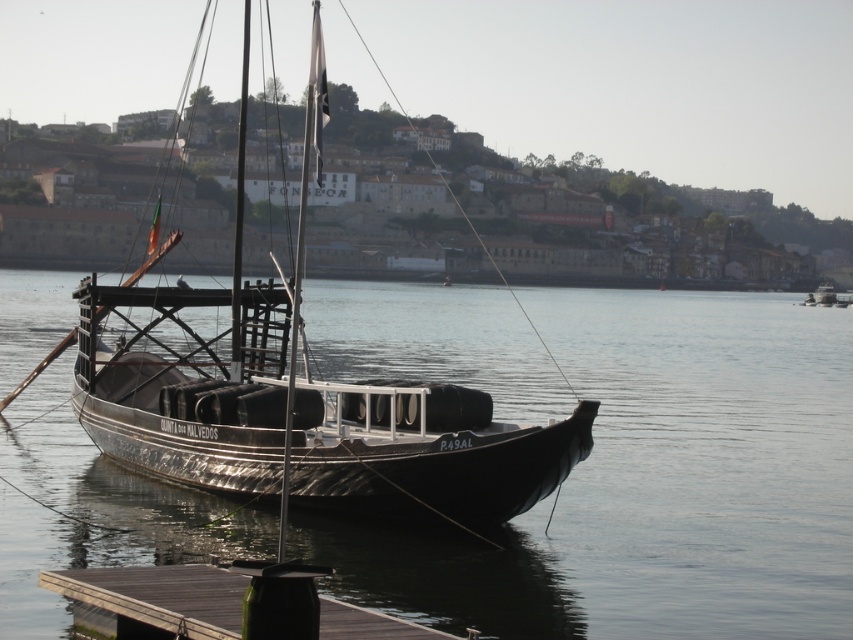
This screenshot has height=640, width=853. I want to click on wooden sailboat at center, so [x=299, y=412].

Between wooden sailboat at center and wooden dock at lower left, which one has less height?

wooden dock at lower left is shorter.

Is point (254, 356) closer to camera compared to point (122, 573)?

No, it is not.

You are a GUI agent. You are given a task and a screenshot of the screen. Output one action in this format:
    pyautogui.click(x=<x>, y=<y>)
    Task: Click on the wooden sailboat at center
    The image size is (853, 640).
    Given the screenshot: What is the action you would take?
    pyautogui.click(x=299, y=412)

Between black smooth water at center and wooden dock at lower left, which one has less height?

With less height is wooden dock at lower left.

Which of these two, black smooth water at center or wooden dock at lower left, stands taller?

With more height is black smooth water at center.

Between point (788, 472) and point (177, 570), which one is positioned behind?

Positioned behind is point (788, 472).

Locate an element on the screen. black smooth water at center is located at coordinates (654, 484).

Between black smooth water at center and wooden sailboat at center, which one appears on the right side from the viewer's perspective?

From the viewer's perspective, black smooth water at center appears more on the right side.

Can you confirm if black smooth water at center is taller than wooden sailboat at center?

No, black smooth water at center is not taller than wooden sailboat at center.

I want to click on black smooth water at center, so click(x=654, y=484).